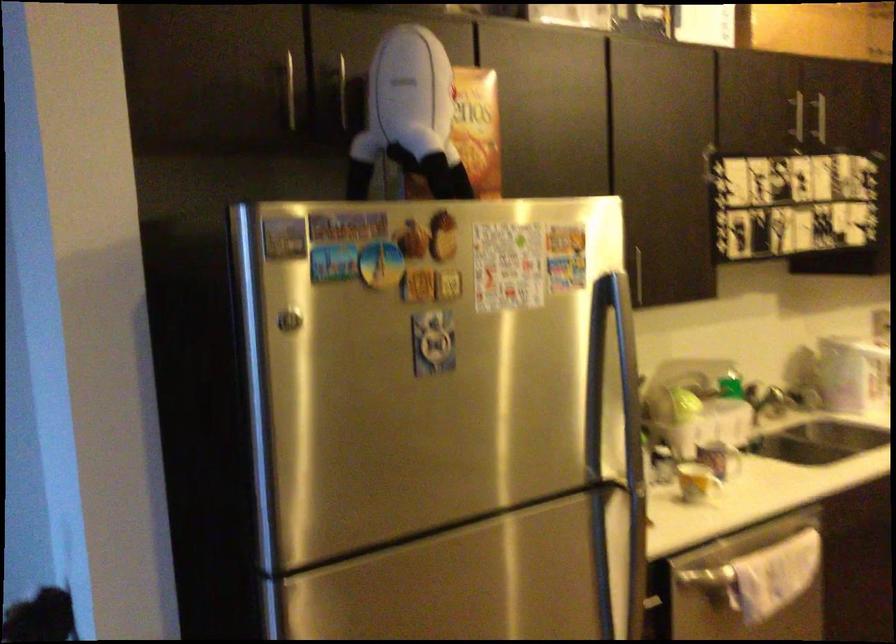
The height and width of the screenshot is (644, 896). Identify the location of white kettle handle. (876, 375).